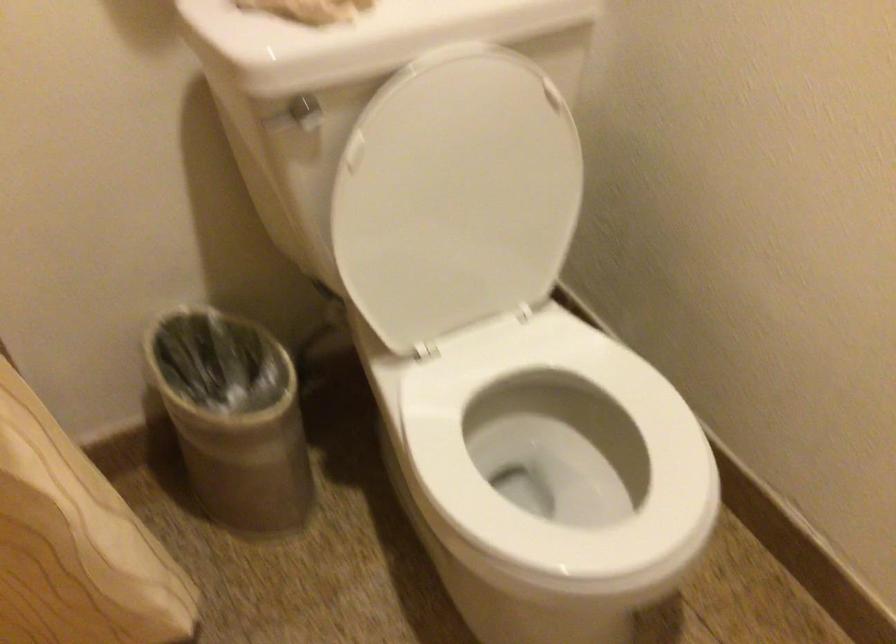
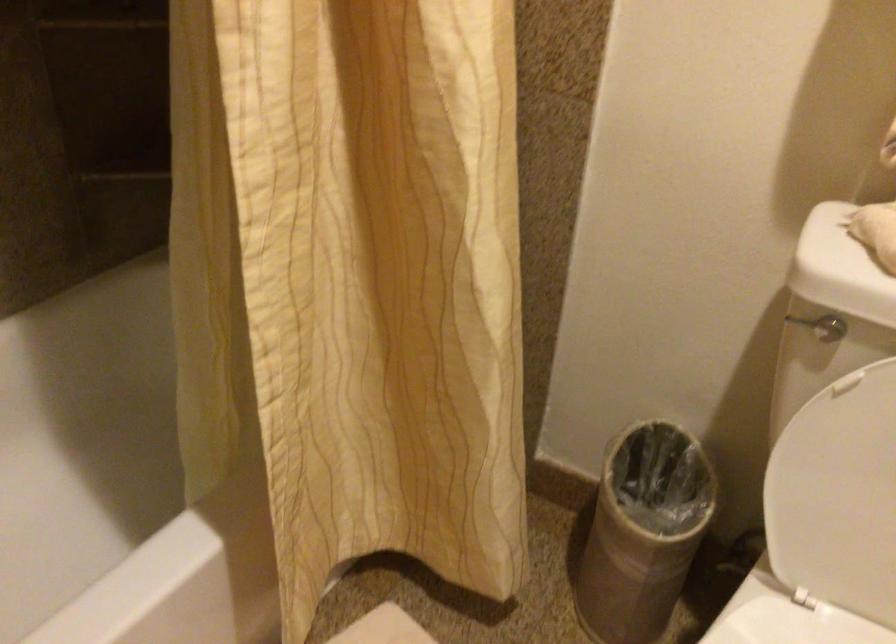
Find the pixel in the second image that matches point (263, 418) in the first image.

(643, 532)